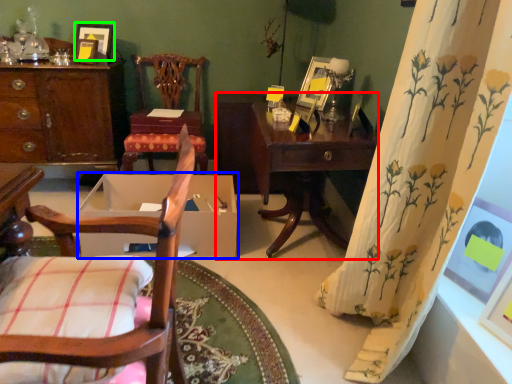
Question: Which object is the farthest from table (highlighted by a red box)? Choose among these: cardboard box (highlighted by a blue box) or picture frame (highlighted by a green box).

Choices:
 (A) cardboard box
 (B) picture frame

Answer: (B)